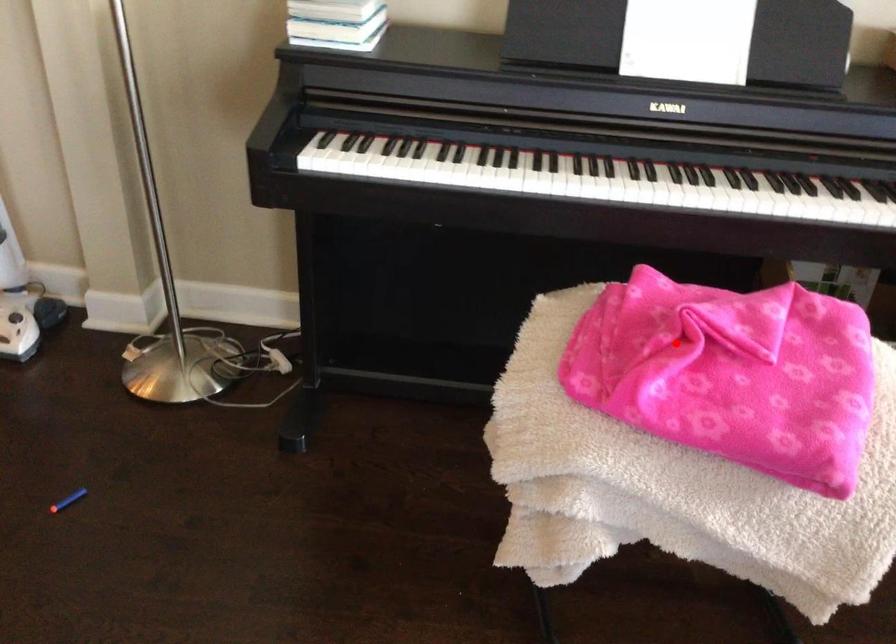
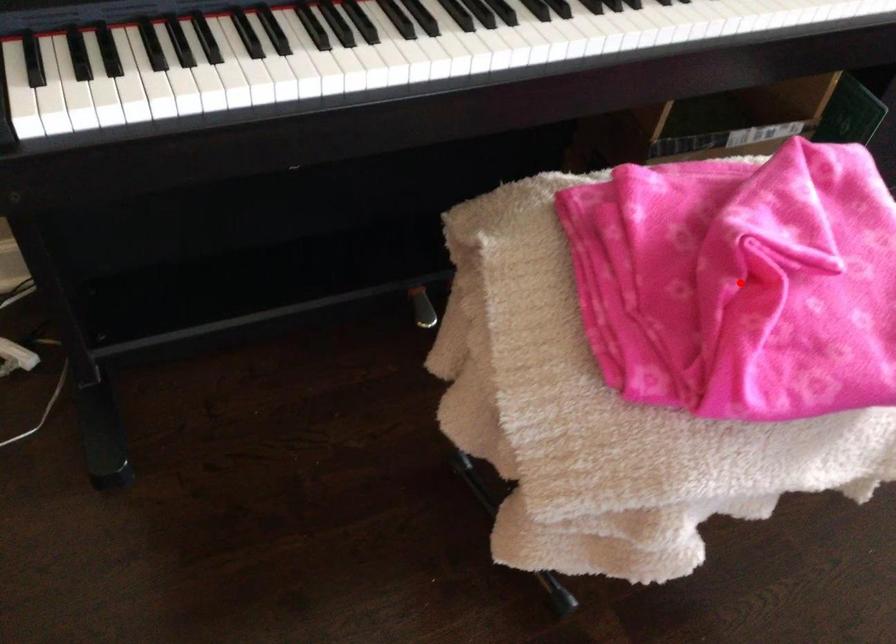
I am providing you with two images of the same scene from different viewpoints. A red point is marked on the first image and another point is marked on the second image. Is the red point in image1 aligned with the point shown in image2?

Yes